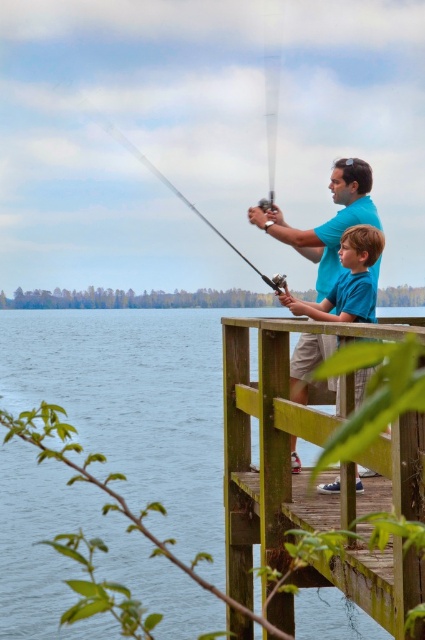
Does silver metallic fishing pole at upper center have a lesser width compared to shiny metallic fishing pole at center?

Yes, silver metallic fishing pole at upper center is thinner than shiny metallic fishing pole at center.

Who is more forward, (271,28) or (237,248)?

Point (237,248)

The image size is (425, 640). Find the location of `silver metallic fishing pole at upper center`. silver metallic fishing pole at upper center is located at coordinates click(x=272, y=88).

Can you confirm if wooden dock at center is bigger than shiny metallic fishing pole at center?

No.

Does wooden dock at center appear on the right side of shiny metallic fishing pole at center?

Indeed, wooden dock at center is positioned on the right side of shiny metallic fishing pole at center.

Where is `wooden dock at center`? This screenshot has width=425, height=640. wooden dock at center is located at coordinates (286, 458).

The height and width of the screenshot is (640, 425). I want to click on wooden dock at center, so click(x=286, y=458).

Is wooden dock at center wider than blue matte shirt at center?

Incorrect, wooden dock at center's width does not surpass blue matte shirt at center's.

Between wooden dock at center and blue matte shirt at center, which one has less height?

blue matte shirt at center is shorter.

Does point (238, 636) come in front of point (343, 280)?

No, (238, 636) is behind (343, 280).

This screenshot has width=425, height=640. Find the location of `wooden dock at center`. wooden dock at center is located at coordinates (286, 458).